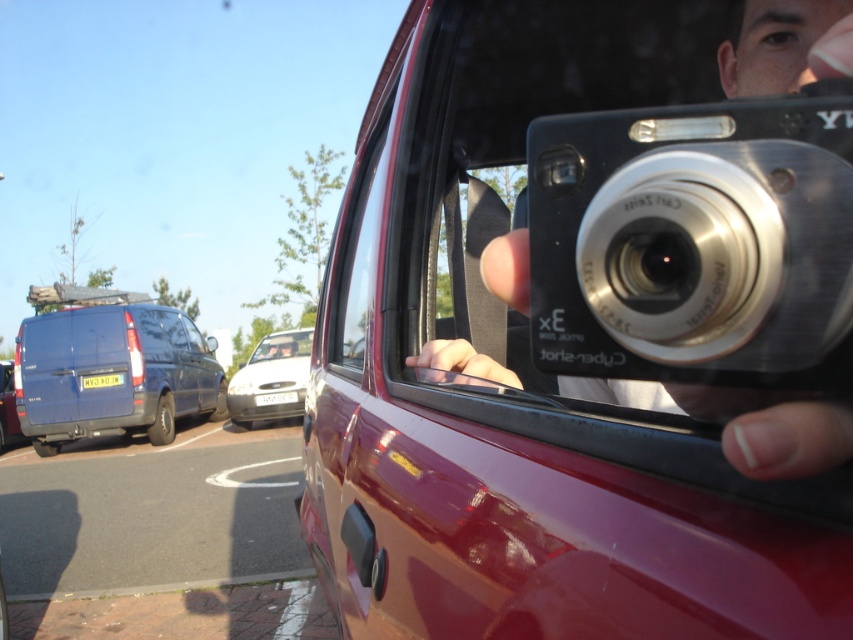
You are trying to decide whether to place a new phone stand on the table next to the black plastic camera at upper right and the white glossy car at center. The stand requires at least 15 cm of space between the two objects. Based on the scene, can you determine if there is enough space?

The black plastic camera at upper right is shorter than the white glossy car at center, but the spatial relationship between their positions isn

You are trying to determine the exact location of the black plastic camera at upper right in the image. According to the coordinates provided, where is it located?

The black plastic camera at upper right is located at point coordinates of (x=695, y=241).

You are trying to decide whether to place a new sticker on either the black plastic camera at upper right or the blue metallic van at left. Based on their sizes, which object would allow the sticker to be more visible?

The blue metallic van at left is larger than the black plastic camera at upper right, so placing the sticker on the blue metallic van at left would make it more visible.